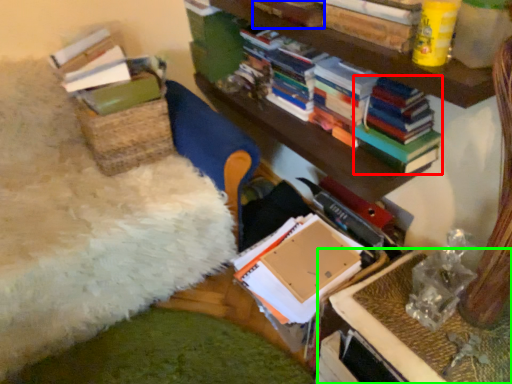
Question: Based on their relative distances, which object is nearer to magazine (highlighted by a red box)? Choose from book (highlighted by a blue box) and table (highlighted by a green box).

Choices:
 (A) book
 (B) table

Answer: (A)